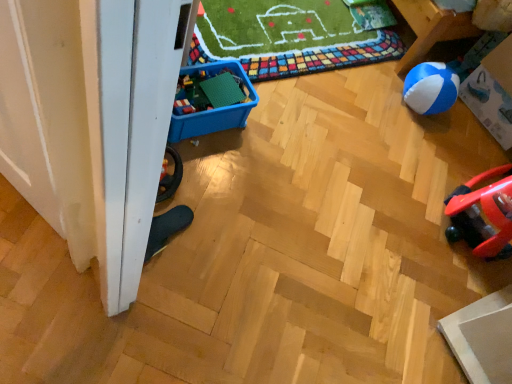
Question: Is blue and white rubber ball at right oriented towards blue plastic storage box at lower left, the first storage box positioned from the left?

Choices:
 (A) yes
 (B) no

Answer: (A)

Question: Is blue and white rubber ball at right thinner than blue plastic storage box at lower left, the first storage box positioned from the left?

Choices:
 (A) yes
 (B) no

Answer: (A)

Question: Is blue and white rubber ball at right to the left of blue plastic storage box at lower left, arranged as the first storage box when viewed from the front, from the viewer's perspective?

Choices:
 (A) yes
 (B) no

Answer: (B)

Question: Is blue and white rubber ball at right closer to camera compared to blue plastic storage box at lower left, the second storage box when ordered from right to left?

Choices:
 (A) yes
 (B) no

Answer: (B)

Question: Does blue and white rubber ball at right have a lesser height compared to blue plastic storage box at lower left, the second storage box when ordered from right to left?

Choices:
 (A) yes
 (B) no

Answer: (B)

Question: Considering the relative sizes of blue and white rubber ball at right and blue plastic storage box at lower left, the second storage box when ordered from right to left, in the image provided, is blue and white rubber ball at right bigger than blue plastic storage box at lower left, the second storage box when ordered from right to left,?

Choices:
 (A) yes
 (B) no

Answer: (B)

Question: Is blue and white plastic storage box at right, the 1th storage box when ordered from right to left, shorter than blue and white rubber ball at right?

Choices:
 (A) no
 (B) yes

Answer: (A)

Question: Is blue and white plastic storage box at right, which appears as the first storage box when viewed from the back, outside blue and white rubber ball at right?

Choices:
 (A) yes
 (B) no

Answer: (A)

Question: Does blue and white plastic storage box at right, the 1th storage box when ordered from right to left, appear on the left side of blue and white rubber ball at right?

Choices:
 (A) no
 (B) yes

Answer: (A)

Question: Does blue and white plastic storage box at right, which appears as the first storage box when viewed from the back, appear on the right side of blue and white rubber ball at right?

Choices:
 (A) no
 (B) yes

Answer: (B)

Question: Is blue and white plastic storage box at right, the 1th storage box when ordered from right to left, positioned before blue and white rubber ball at right?

Choices:
 (A) no
 (B) yes

Answer: (B)

Question: Is blue and white rubber ball at right at the back of blue and white plastic storage box at right, positioned as the 2th storage box in left-to-right order?

Choices:
 (A) no
 (B) yes

Answer: (A)

Question: Does green plastic building blocks at center-left have a lesser width compared to blue and white plastic storage box at right, positioned as the 2th storage box in left-to-right order?

Choices:
 (A) no
 (B) yes

Answer: (B)